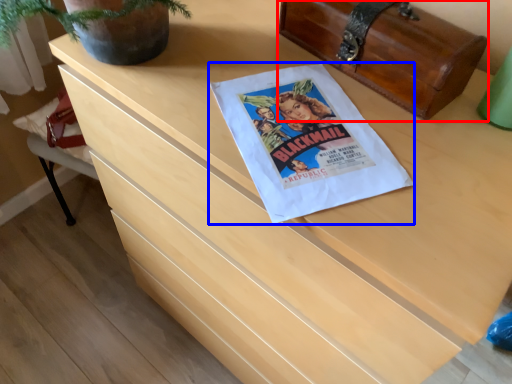
Question: Which object appears closest to the camera in this image, chest (highlighted by a red box) or flyer (highlighted by a blue box)?

Choices:
 (A) chest
 (B) flyer

Answer: (B)